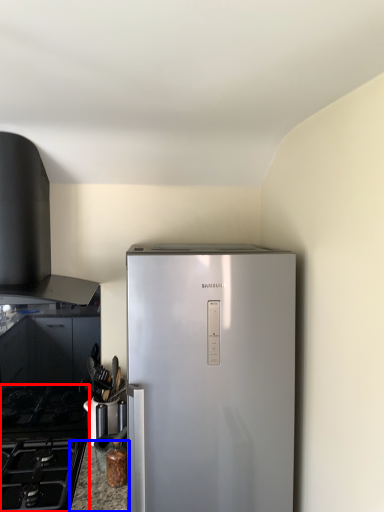
Question: Which point is further to the camera, gas stove (highlighted by a red box) or counter top (highlighted by a blue box)?

Choices:
 (A) gas stove
 (B) counter top

Answer: (B)